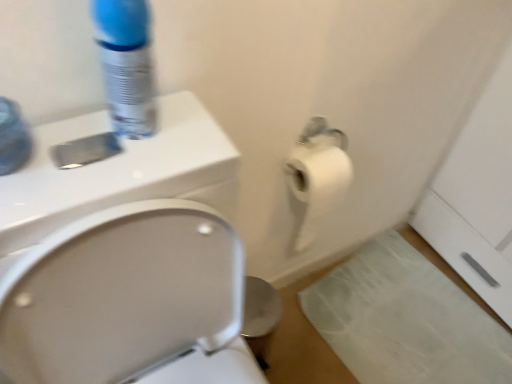
Describe the element at coordinates (126, 65) in the screenshot. I see `metallic silver spray can at upper left` at that location.

Image resolution: width=512 pixels, height=384 pixels. Identify the location of metallic silver spray can at upper left. (126, 65).

I want to click on metallic silver spray can at upper left, so click(x=126, y=65).